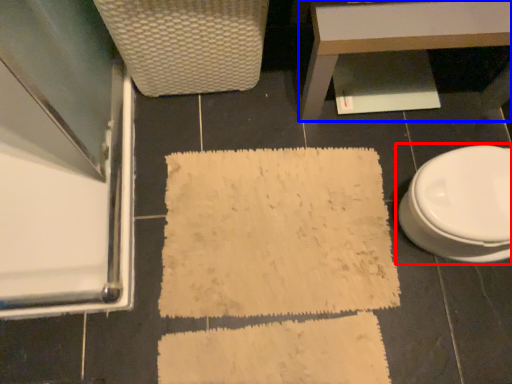
Question: Which of the following is the closest to the observer, toilet (highlighted by a red box) or table (highlighted by a blue box)?

Choices:
 (A) toilet
 (B) table

Answer: (A)